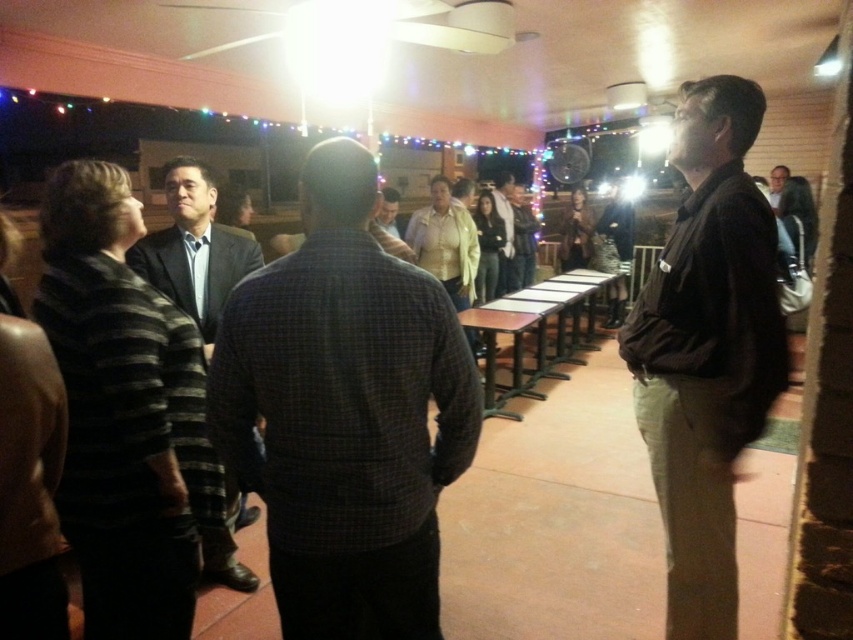
Question: Which point is closer to the camera taking this photo?

Choices:
 (A) (387, 188)
 (B) (815, 240)
 (C) (190, 241)

Answer: (C)

Question: Is dark brown shirt at center further to camera compared to brown shirt at right?

Choices:
 (A) yes
 (B) no

Answer: (B)

Question: Which of the following is the closest to the observer?

Choices:
 (A) plaid shirt at center
 (B) matte yellow shirt at center
 (C) brown shirt at right

Answer: (A)

Question: Is dark brown shirt at center wider than dark suit at center?

Choices:
 (A) yes
 (B) no

Answer: (B)

Question: Is dark brown shirt at center thinner than matte yellow shirt at center?

Choices:
 (A) no
 (B) yes

Answer: (A)

Question: Which point is closer to the camera taking this photo?

Choices:
 (A) (730, 84)
 (B) (257, 330)

Answer: (B)